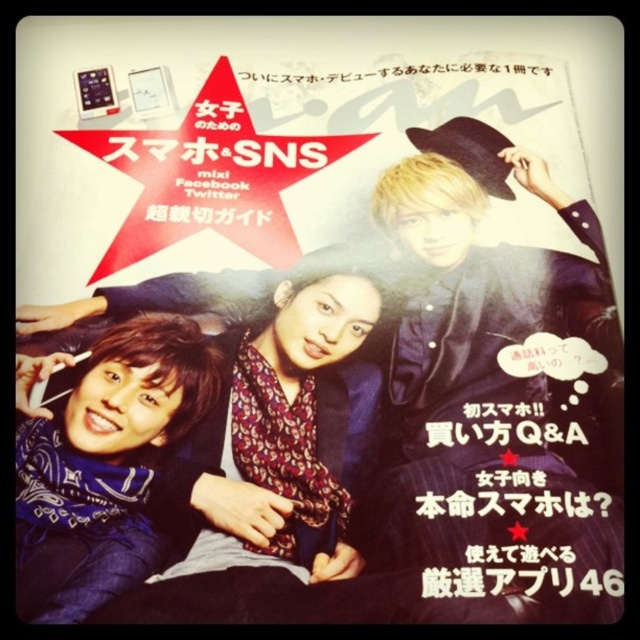
Is black pinstriped suit at upper right to the left of blacktextured paperposter at upper center from the viewer's perspective?

Indeed, black pinstriped suit at upper right is positioned on the left side of blacktextured paperposter at upper center.

Is black pinstriped suit at upper right closer to camera compared to blacktextured paperposter at upper center?

Yes, it is in front of blacktextured paperposter at upper center.

Which is behind, point (419, 516) or point (588, 572)?

Point (419, 516)

This screenshot has width=640, height=640. Identify the location of black pinstriped suit at upper right. (497, 392).

Is point (358, 456) closer to viewer compared to point (564, 541)?

No, (358, 456) is further to viewer.

Does printed scarf at center appear on the right side of blacktextured paperposter at upper center?

No, printed scarf at center is not to the right of blacktextured paperposter at upper center.

Does point (273, 321) come in front of point (570, 572)?

No, it is behind (570, 572).

This screenshot has width=640, height=640. In order to click on printed scarf at center in this screenshot , I will do `click(291, 433)`.

Based on the photo, can you confirm if black pinstriped suit at upper right is positioned below blue bandana at lower left?

No.

The height and width of the screenshot is (640, 640). What do you see at coordinates (497, 392) in the screenshot? I see `black pinstriped suit at upper right` at bounding box center [497, 392].

Identify the location of black pinstriped suit at upper right. This screenshot has height=640, width=640. (497, 392).